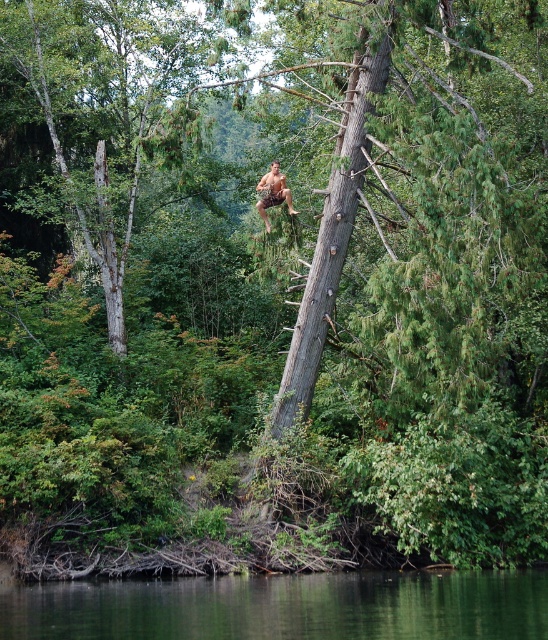
Based on the scene, which object occupies more area in the image? Please consider the green liquid water at lower center and the gray rough bark tree trunk at center in your answer.

The green liquid water at lower center occupies more area in the image compared to the gray rough bark tree trunk at center, as stated in the description.

You are an observer looking at the man climbing the tree. There are two points marked on the tree trunk, one at coordinates point (349, 577) and the other at point (322, 298). Which of these points is closer to you?

Point (349, 577) is closer to the viewer than point (322, 298).